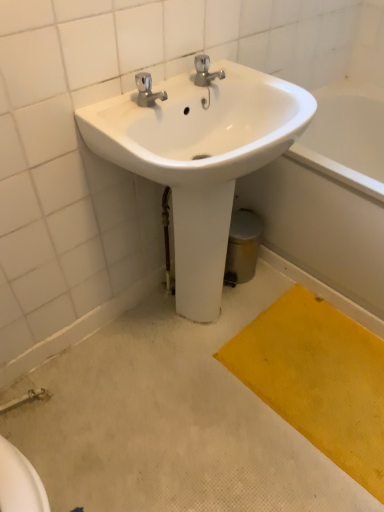
Find the location of a particular element. This screenshot has width=384, height=512. free space between white glossy sink at upper center and yellow fabric doormat at lower right is located at coordinates (259, 417).